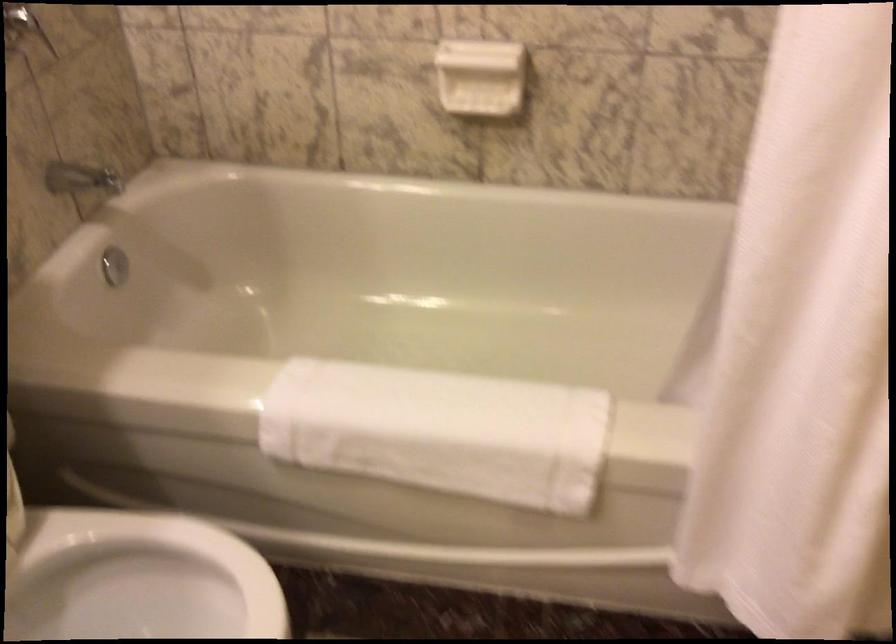
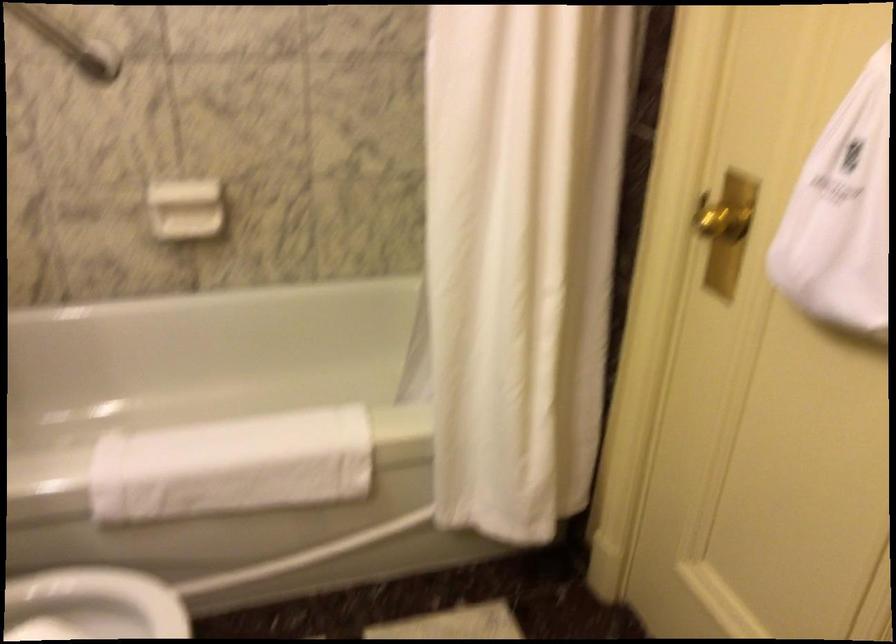
Locate, in the second image, the point that corresponds to (419,430) in the first image.

(231, 466)